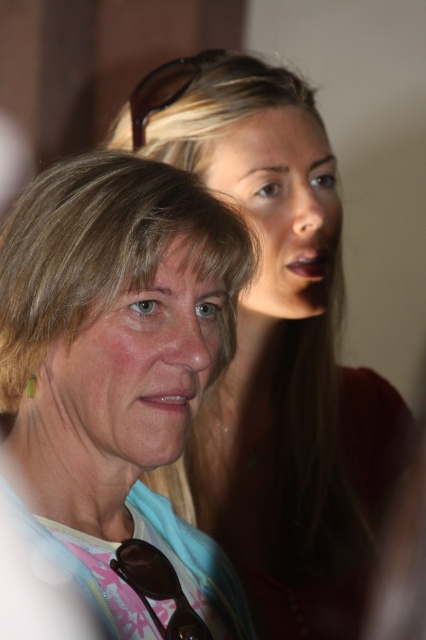
Question: Does matte skin at center have a smaller size compared to smooth skin face at upper center?

Choices:
 (A) yes
 (B) no

Answer: (B)

Question: Which is nearer to the matte skin at center?

Choices:
 (A) matte white shirt at center
 (B) smooth skin face at center
 (C) smooth skin face at upper center

Answer: (C)

Question: Observing the image, what is the correct spatial positioning of matte white shirt at center in reference to smooth skin face at center?

Choices:
 (A) left
 (B) right

Answer: (A)

Question: Which point is farther to the camera?

Choices:
 (A) (161, 301)
 (B) (218, 580)
 (C) (276, 269)
 (D) (265, 244)

Answer: (C)

Question: Does smooth skin face at center appear under smooth skin face at upper center?

Choices:
 (A) no
 (B) yes

Answer: (B)

Question: Which of the following is the farthest from the observer?

Choices:
 (A) (123, 381)
 (B) (173, 64)
 (C) (74, 401)

Answer: (B)